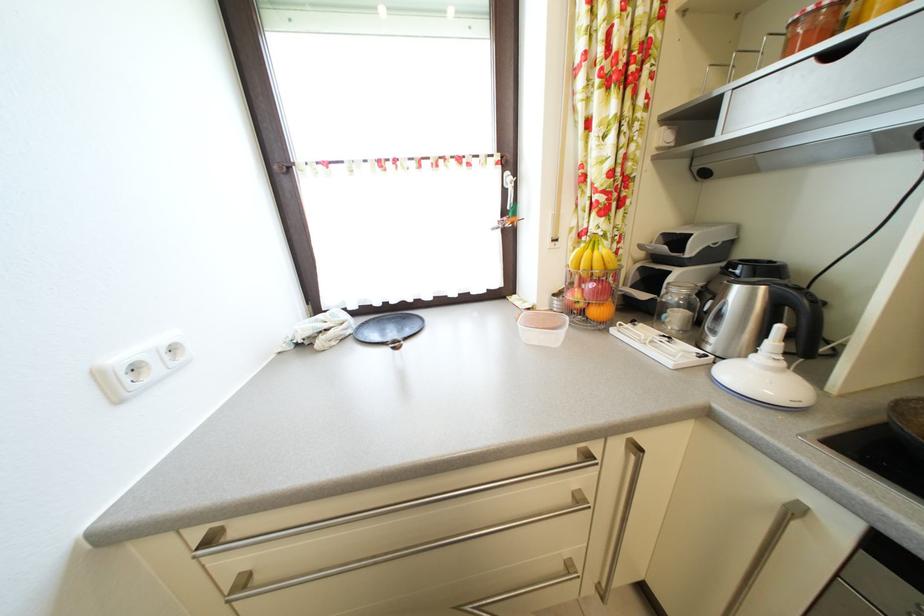
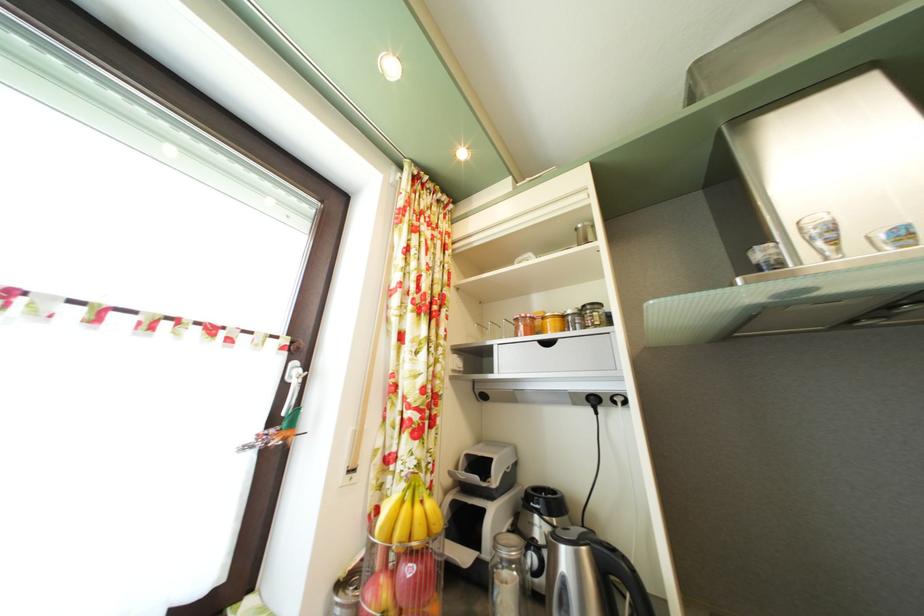
From the picture: Based on the continuous images, in which direction is the camera rotating?

The camera's rotation is toward right-up.